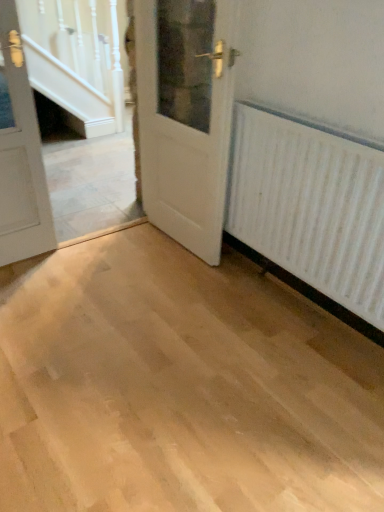
Question: Is white textured radiator at right inside or outside of white wood door at center, the 1th door positioned from the right?

Choices:
 (A) inside
 (B) outside

Answer: (B)

Question: Considering their positions, is white textured radiator at right located in front of or behind white wood door at center, the 1th door positioned from the right?

Choices:
 (A) front
 (B) behind

Answer: (A)

Question: Which of these objects is positioned farthest from the white wood door at left, the 2th door viewed from the right?

Choices:
 (A) white wood door at center, placed as the 2th door when sorted from left to right
 (B) white textured radiator at right

Answer: (B)

Question: Which of these objects is positioned farthest from the white wood door at left, the 1th door when ordered from left to right?

Choices:
 (A) white wood door at center, the 1th door positioned from the right
 (B) white textured radiator at right

Answer: (B)